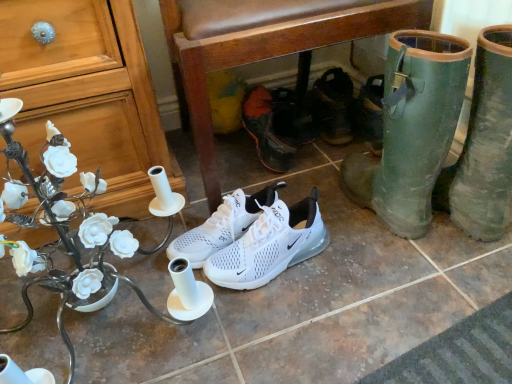
The height and width of the screenshot is (384, 512). I want to click on free spot in front of white mesh sneakers at center, the 2th footwear viewed from the front, so click(x=282, y=326).